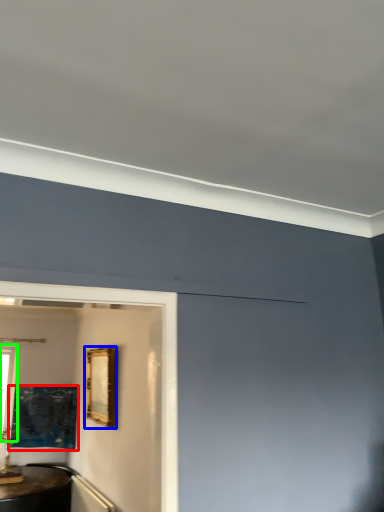
Question: Based on their relative distances, which object is farther from picture frame (highlighted by a red box)? Choose from picture frame (highlighted by a blue box) and window (highlighted by a green box).

Choices:
 (A) picture frame
 (B) window

Answer: (A)